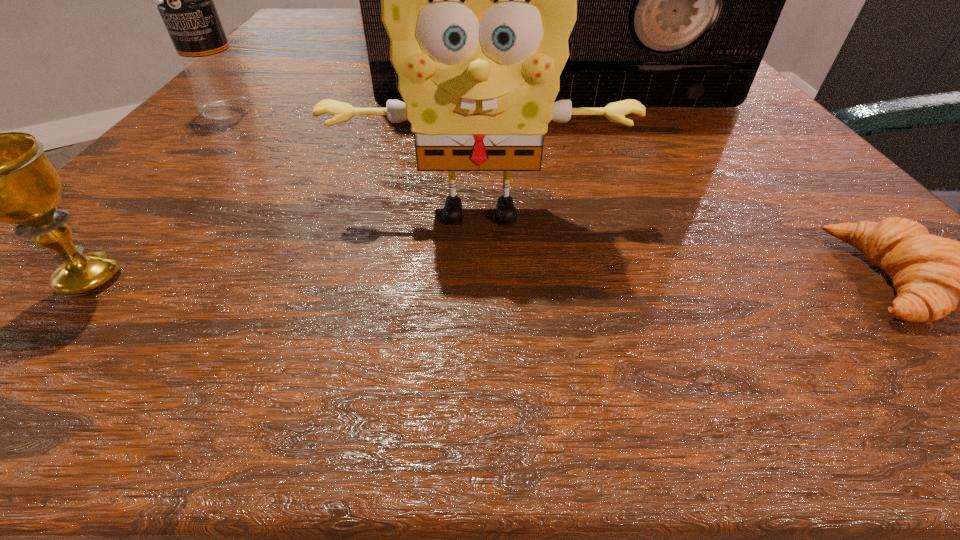
Where is `chalice that is at the left edge`? This screenshot has width=960, height=540. chalice that is at the left edge is located at coordinates (0, 177).

Find the location of a particular element. This screenshot has height=540, width=960. object that is at the right edge is located at coordinates pyautogui.click(x=677, y=0).

This screenshot has height=540, width=960. I want to click on object at the near left corner, so click(x=0, y=177).

Locate an element on the screen. Image resolution: width=960 pixels, height=540 pixels. free space at the near edge of the desktop is located at coordinates (302, 321).

The image size is (960, 540). In order to click on vacant space at the left edge of the desktop in this screenshot , I will do `click(340, 55)`.

Locate an element on the screen. This screenshot has width=960, height=540. vacant area at the right edge is located at coordinates (801, 225).

Locate an element on the screen. Image resolution: width=960 pixels, height=540 pixels. vacant point located between the chalice and the tallest object is located at coordinates (324, 189).

Locate an element on the screen. The height and width of the screenshot is (540, 960). free space between the fourth tallest object and the sponge is located at coordinates (285, 246).

The height and width of the screenshot is (540, 960). Find the location of `empty space between the sponge and the second shortest object`. empty space between the sponge and the second shortest object is located at coordinates (285, 246).

Where is `free space that is in between the chalice and the sponge`? This screenshot has height=540, width=960. free space that is in between the chalice and the sponge is located at coordinates (285, 246).